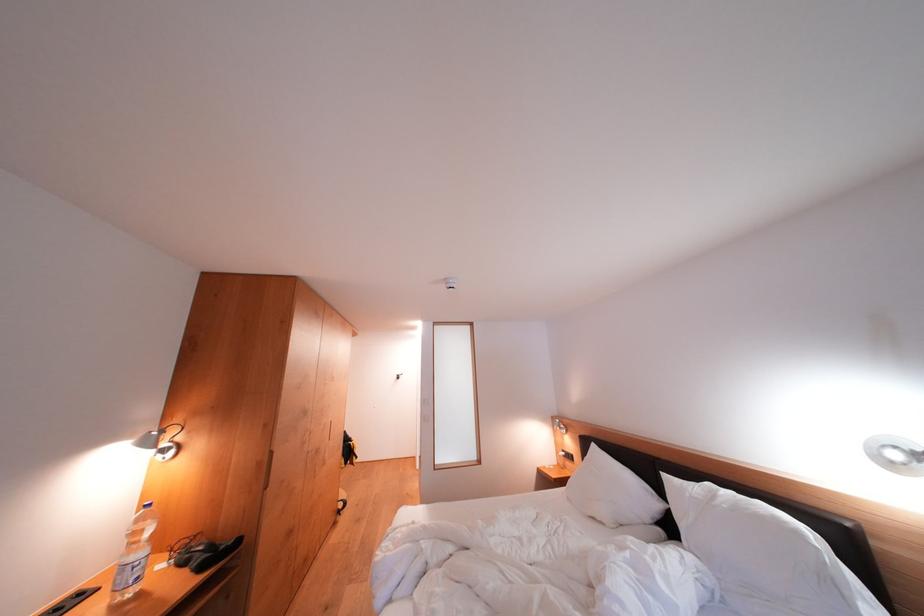
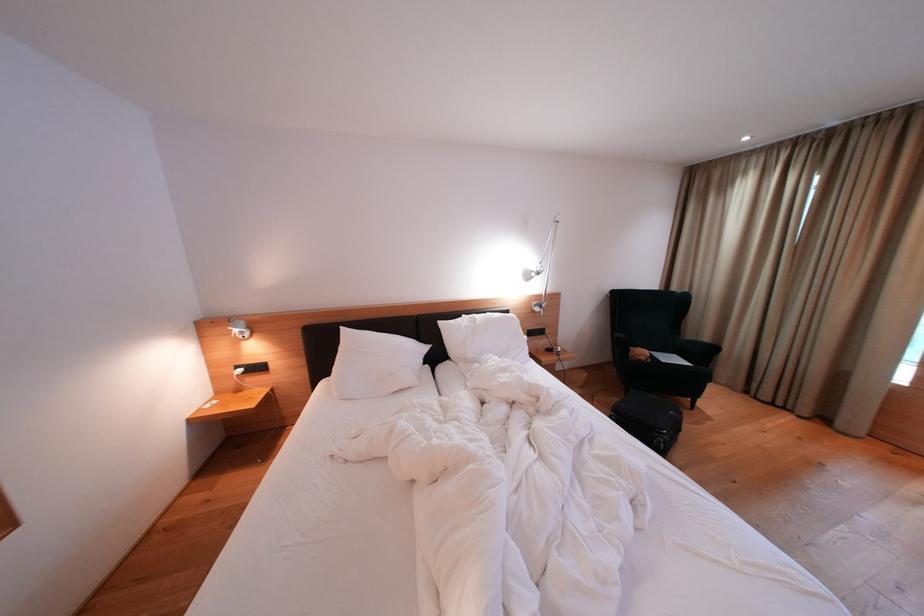
Locate, in the second image, the point that corresponds to (x=672, y=480) in the first image.

(447, 328)